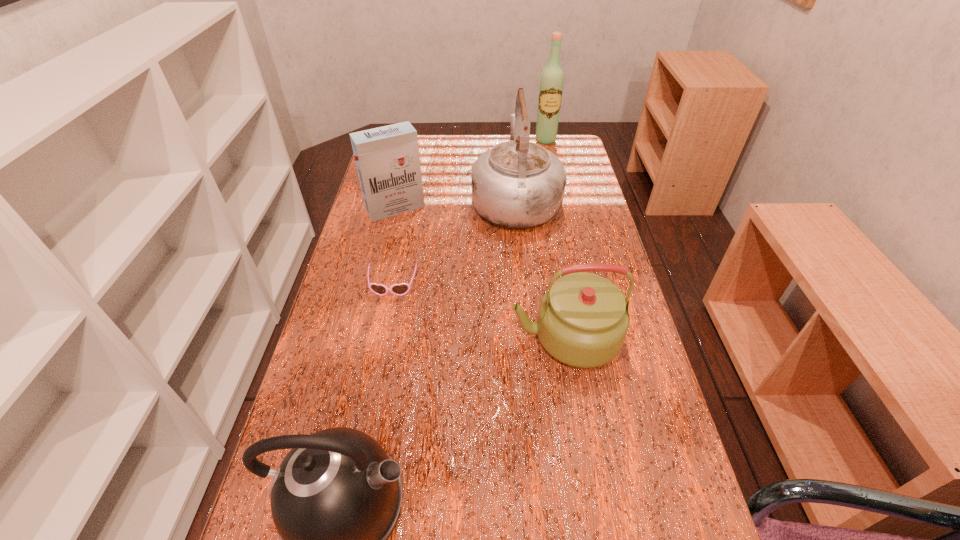
This screenshot has width=960, height=540. Identify the location of vacant area situated on the front of the cigarette case. (378, 284).

Where is `blank area located at the spout of the fifth farthest object`? This screenshot has height=540, width=960. blank area located at the spout of the fifth farthest object is located at coordinates (485, 337).

The height and width of the screenshot is (540, 960). Find the location of `free space located at the spout of the fifth farthest object`. free space located at the spout of the fifth farthest object is located at coordinates (401, 337).

This screenshot has width=960, height=540. Find the location of `vacant space located 0.260m at the spout of the fifth farthest object`. vacant space located 0.260m at the spout of the fifth farthest object is located at coordinates (401, 337).

Find the location of `vacant area situated on the front-facing side of the sunglasses`. vacant area situated on the front-facing side of the sunglasses is located at coordinates (379, 356).

In order to click on object at the far edge in this screenshot , I will do `click(552, 78)`.

Find the location of `cigarette case present at the left edge`. cigarette case present at the left edge is located at coordinates (387, 158).

Locate an element on the screen. The height and width of the screenshot is (540, 960). sunglasses at the left edge is located at coordinates (401, 289).

Identify the location of wine bottle located in the right edge section of the desktop. The image size is (960, 540). (552, 78).

Find the location of `object that is at the far right corner`. object that is at the far right corner is located at coordinates (552, 78).